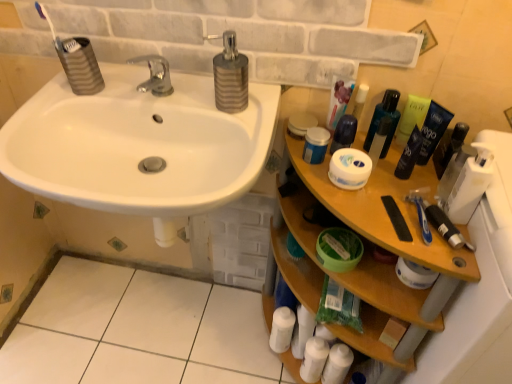
The image size is (512, 384). I want to click on unoccupied area behind white matte bottle at lower center, the third toiletry in the right-to-left sequence, so click(x=253, y=311).